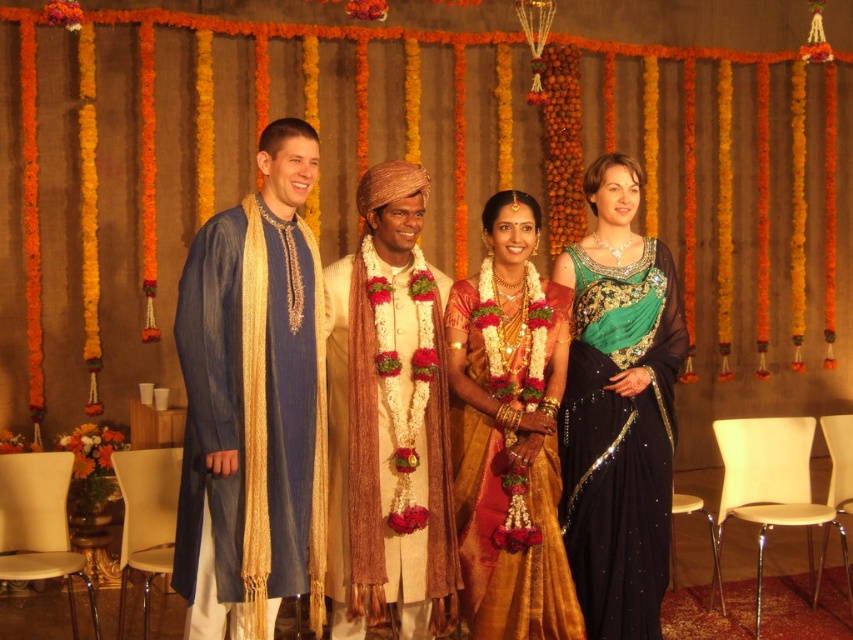
You are a photographer at this event and need to capture a group photo. The camera you are using has a focus range of 25 inches. Can you adjust your position so that both the blue silk kurta at left and the gold silk saree at center are within the camera focus range?

The distance between the blue silk kurta at left and the gold silk saree at center is 28.61 inches, which exceeds the camera focus range of 25 inches. Therefore, you cannot capture both within the focus range without adjusting their positions.

You are a photographer at this event. You need to position a spotlight exactly at the point marked by the coordinates point (253, 403). Which person should you direct the spotlight towards?

The point (253, 403) indicates the blue silk kurta at left, so you should direct the spotlight towards the person wearing the blue silk kurta at left.

You are a photographer at this event and want to ensure both the blue silk kurta at left and the gold silk saree at center are clearly visible in your photo. Which clothing item requires more space in the frame to capture its full detail?

The blue silk kurta at left requires more space in the frame because it is larger in size than the gold silk saree at center.